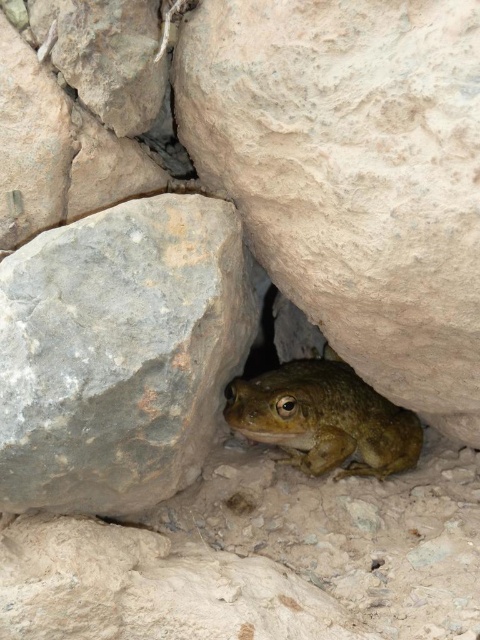
Question: Which point is closer to the camera?

Choices:
 (A) gray rough rock at center
 (B) greenish-brown textured frog at center

Answer: (A)

Question: Does gray rough rock at center lie in front of greenish-brown textured frog at center?

Choices:
 (A) no
 (B) yes

Answer: (B)

Question: Considering the real-world distances, which object is farthest from the rough textured rock at center?

Choices:
 (A) greenish-brown textured frog at center
 (B) gray rough rock at center

Answer: (A)

Question: In this image, where is rough textured rock at center located relative to gray rough rock at center?

Choices:
 (A) above
 (B) below

Answer: (A)

Question: Considering the real-world distances, which object is farthest from the greenish-brown textured frog at center?

Choices:
 (A) rough textured rock at center
 (B) gray rough rock at center

Answer: (A)

Question: Does rough textured rock at center have a larger size compared to gray rough rock at center?

Choices:
 (A) yes
 (B) no

Answer: (A)